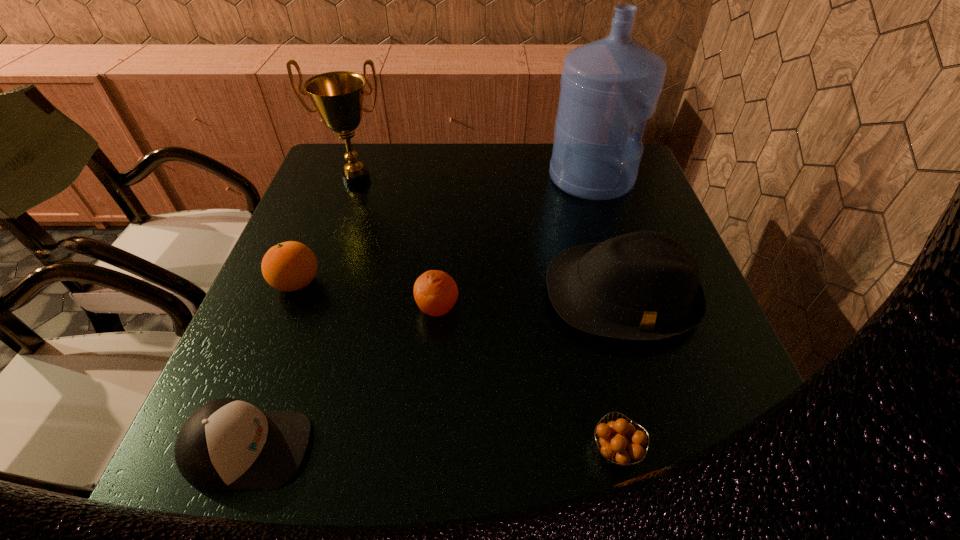
Where is `the tallest object`? This screenshot has width=960, height=540. the tallest object is located at coordinates (607, 86).

Find the location of a particular element. Image resolution: width=960 pixels, height=540 pixels. the second tallest object is located at coordinates (338, 96).

Locate an element on the screen. fedora is located at coordinates (643, 286).

Locate an element on the screen. The height and width of the screenshot is (540, 960). the leftmost orange fruit is located at coordinates (289, 266).

Locate an element on the screen. the fourth object from left to right is located at coordinates pos(435,292).

At what (x,y) coordinates should I click in order to perform the action: click on cap. Please return your answer as a coordinate pair (x, y). Image resolution: width=960 pixels, height=540 pixels. Looking at the image, I should click on (227, 444).

Locate an element on the screen. The width and height of the screenshot is (960, 540). the shortest object is located at coordinates (618, 448).

Where is `the nearest orange fruit`? the nearest orange fruit is located at coordinates (618, 448).

Locate an element on the screen. vacant space located 0.360m on the front view with handles of the sixth shortest object is located at coordinates (317, 294).

Identify the location of vacant space situated on the front-facing side of the third tallest object. (670, 461).